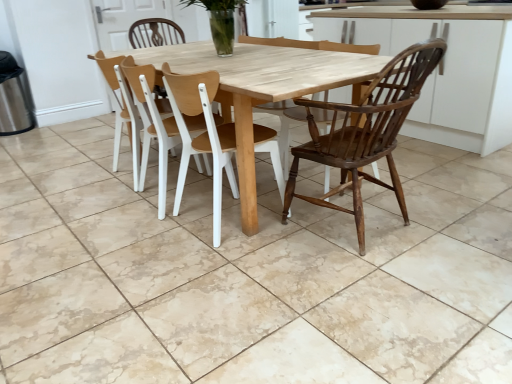
You are a GUI agent. You are given a task and a screenshot of the screen. Output one action in this format:
    pyautogui.click(x=<x>, y=<y>)
    Task: Click on the vacant space in front of wooden chair at center, the 2th chair from the right
    Image resolution: width=512 pixels, height=384 pixels.
    Given the screenshot: What is the action you would take?
    pyautogui.click(x=225, y=263)